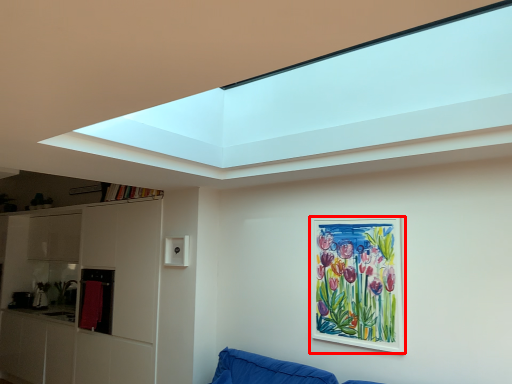
Question: From the image's perspective, what is the correct spatial positioning of picture frame (annotated by the red box) in reference to cabinet?

Choices:
 (A) above
 (B) below

Answer: (A)